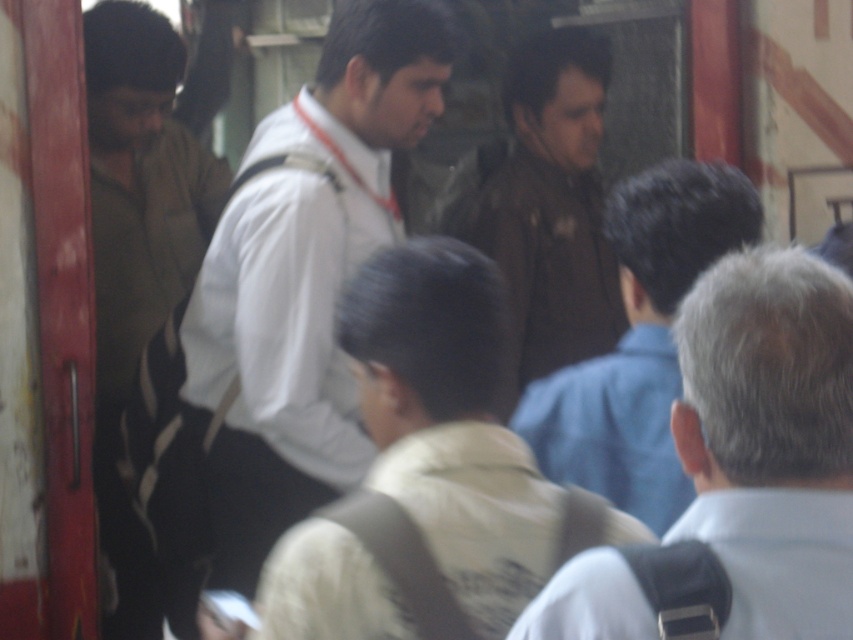
Who is positioned more to the left, beige fabric vest at center or brown cotton shirt at left?

brown cotton shirt at left

Between point (491, 573) and point (109, 224), which one is positioned in front?

Point (491, 573)

At what (x,y) coordinates should I click in order to perform the action: click on beige fabric vest at center. Please return your answer as a coordinate pair (x, y). This screenshot has height=640, width=853. Looking at the image, I should click on (428, 472).

Does gray fabric shirt at upper right come in front of brown leather jacket at upper center?

That is True.

Which is behind, point (738, 321) or point (631, 358)?

The point (631, 358) is more distant.

Where is `gray fabric shirt at upper right`? This screenshot has width=853, height=640. gray fabric shirt at upper right is located at coordinates (770, 436).

Is brown cotton shirt at left wider than brown leather jacket at upper center?

Incorrect, brown cotton shirt at left's width does not surpass brown leather jacket at upper center's.

Can you confirm if brown cotton shirt at left is shorter than brown leather jacket at upper center?

No.

What do you see at coordinates (137, 253) in the screenshot?
I see `brown cotton shirt at left` at bounding box center [137, 253].

The height and width of the screenshot is (640, 853). Identify the location of brown cotton shirt at left. (137, 253).